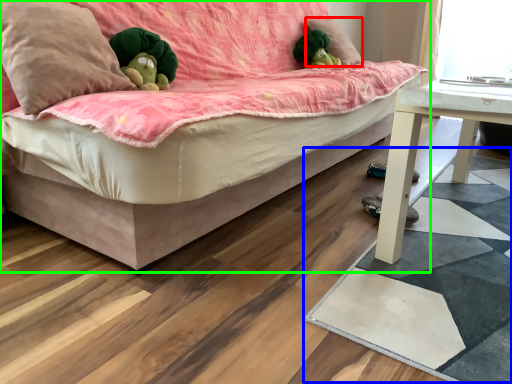
Question: Estimate the real-world distances between objects in this image. Which object is closer to pillow (highlighted by a red box), mat (highlighted by a blue box) or studio couch (highlighted by a green box)?

Choices:
 (A) mat
 (B) studio couch

Answer: (B)